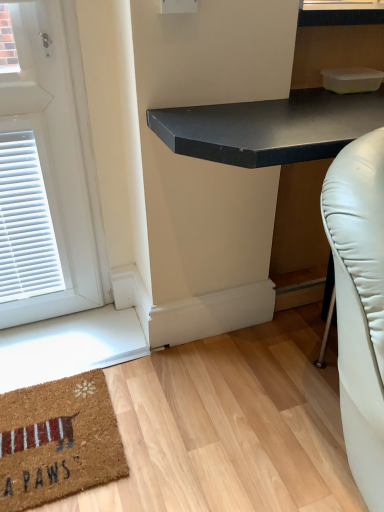
Question: Considering the positions of black matte desk at center and brown coir mat at lower left in the image, is black matte desk at center bigger or smaller than brown coir mat at lower left?

Choices:
 (A) big
 (B) small

Answer: (A)

Question: Does point (276, 143) appear closer or farther from the camera than point (34, 418)?

Choices:
 (A) farther
 (B) closer

Answer: (B)

Question: From the image's perspective, is black matte desk at center above or below brown coir mat at lower left?

Choices:
 (A) above
 (B) below

Answer: (A)

Question: Is brown coir mat at lower left in front of or behind black matte desk at center in the image?

Choices:
 (A) behind
 (B) front

Answer: (A)

Question: Does point (122, 444) appear closer or farther from the camera than point (324, 95)?

Choices:
 (A) farther
 (B) closer

Answer: (B)

Question: In the image, is brown coir mat at lower left on the left side or the right side of black matte desk at center?

Choices:
 (A) left
 (B) right

Answer: (A)

Question: From a real-world perspective, relative to black matte desk at center, is brown coir mat at lower left vertically above or below?

Choices:
 (A) below
 (B) above

Answer: (A)